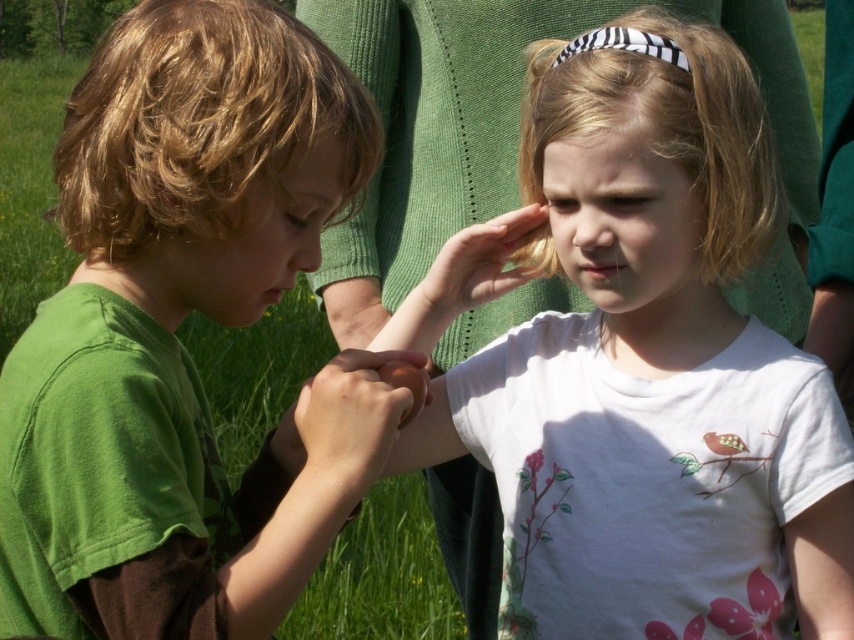
Question: Is smooth brown hand at center bigger than blonde hair at upper right?

Choices:
 (A) no
 (B) yes

Answer: (B)

Question: Can you confirm if white matte shirt at center is positioned to the right of matte white forehead at upper center?

Choices:
 (A) yes
 (B) no

Answer: (A)

Question: Which of the following is the farthest from the observer?

Choices:
 (A) (647, 198)
 (B) (319, 385)

Answer: (A)

Question: Which point appears closest to the camera in this image?

Choices:
 (A) (307, 419)
 (B) (442, 289)

Answer: (A)

Question: Which object appears farthest from the camera in this image?

Choices:
 (A) white matte face at center
 (B) green matte shirt at center

Answer: (A)

Question: Does matte white forehead at upper center appear on the right side of matte green nose at center?

Choices:
 (A) no
 (B) yes

Answer: (B)